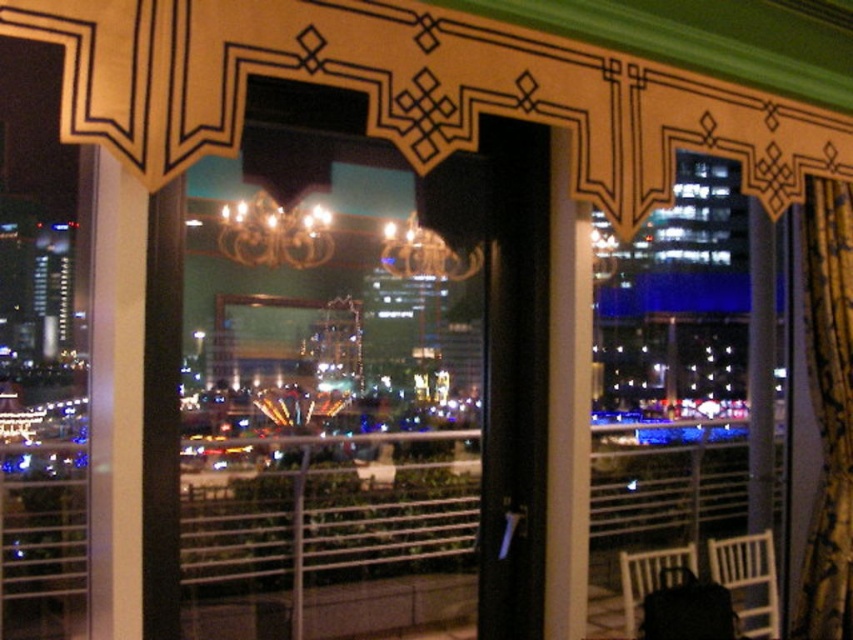
Who is positioned more to the left, gold metallic chandelier at upper center or gold metallic chandelier at center?

gold metallic chandelier at upper center is more to the left.

Does gold metallic chandelier at upper center have a smaller size compared to gold metallic chandelier at center?

No, gold metallic chandelier at upper center is not smaller than gold metallic chandelier at center.

Between point (299, 244) and point (430, 236), which one is positioned behind?

Positioned behind is point (430, 236).

You are a GUI agent. You are given a task and a screenshot of the screen. Output one action in this format:
    pyautogui.click(x=<x>, y=<y>)
    Task: Click on the gold metallic chandelier at upper center
    The image size is (853, 640).
    Given the screenshot: What is the action you would take?
    pyautogui.click(x=274, y=232)

Which is more to the right, gold textured curtain at right or gold metallic chandelier at center?

From the viewer's perspective, gold textured curtain at right appears more on the right side.

Which is behind, point (842, 237) or point (434, 268)?

Positioned behind is point (842, 237).

Locate an element on the screen. Image resolution: width=853 pixels, height=640 pixels. gold textured curtain at right is located at coordinates (828, 410).

This screenshot has height=640, width=853. I want to click on gold textured curtain at right, so [828, 410].

Which is below, gold textured curtain at right or gold metallic chandelier at upper center?

Positioned lower is gold textured curtain at right.

Is gold textured curtain at right taller than gold metallic chandelier at upper center?

Yes, gold textured curtain at right is taller than gold metallic chandelier at upper center.

Does point (833, 320) come farther from viewer compared to point (318, 218)?

That is True.

Find the location of `gold textured curtain at right`. gold textured curtain at right is located at coordinates (828, 410).